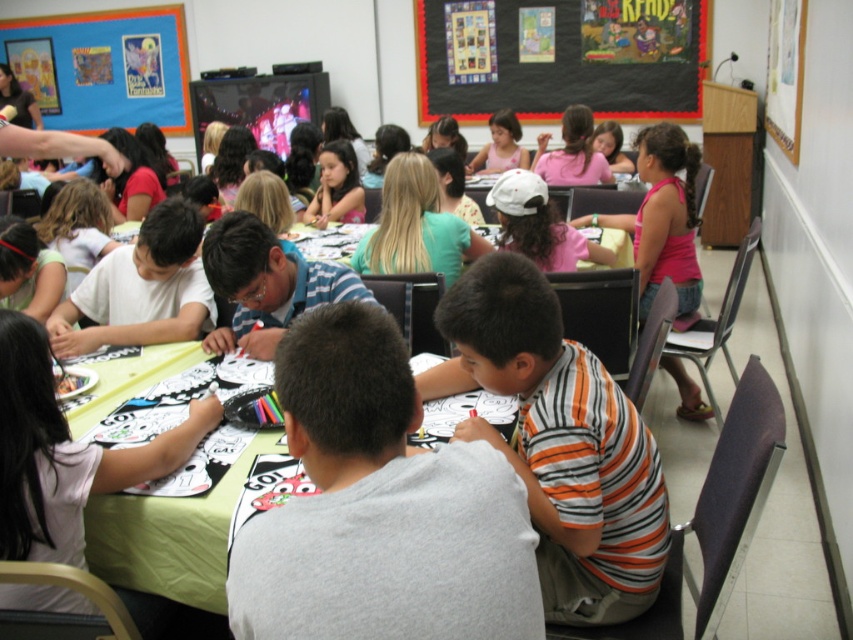
Question: Which point is farther to the camera?

Choices:
 (A) 506,156
 (B) 518,266

Answer: (A)

Question: Which of the following is the farthest from the observer?

Choices:
 (A) (206, 410)
 (B) (335, 196)
 (C) (115, 532)
 (D) (579, 540)

Answer: (B)

Question: Is orange striped shirt at center thinner than smooth skin face at center?

Choices:
 (A) yes
 (B) no

Answer: (B)

Question: Which is nearer to the smooth skin face at center?

Choices:
 (A) black matte bulletin board at upper center
 (B) pink fabric shirt at center
 (C) white paper at center

Answer: (B)

Question: Is white paper at center wider than green fabric table at center?

Choices:
 (A) yes
 (B) no

Answer: (B)

Question: Can you confirm if black matte bulletin board at upper center is positioned to the right of green fabric table at center?

Choices:
 (A) yes
 (B) no

Answer: (A)